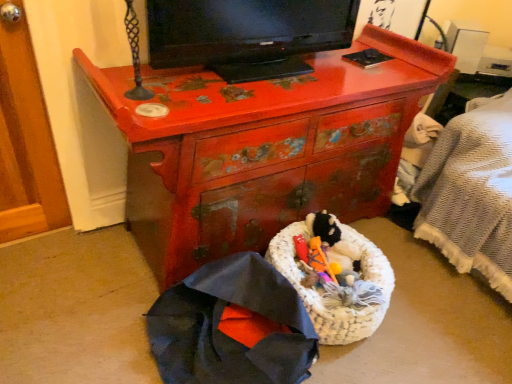
Question: Is cherry wood dresser at center not close to dark blue fabric umbrella at lower left?

Choices:
 (A) yes
 (B) no

Answer: (B)

Question: Considering the relative sizes of cherry wood dresser at center and dark blue fabric umbrella at lower left in the image provided, is cherry wood dresser at center wider than dark blue fabric umbrella at lower left?

Choices:
 (A) no
 (B) yes

Answer: (B)

Question: Can you confirm if cherry wood dresser at center is taller than dark blue fabric umbrella at lower left?

Choices:
 (A) no
 (B) yes

Answer: (B)

Question: Does cherry wood dresser at center have a smaller size compared to dark blue fabric umbrella at lower left?

Choices:
 (A) no
 (B) yes

Answer: (A)

Question: From the image's perspective, is cherry wood dresser at center located above dark blue fabric umbrella at lower left?

Choices:
 (A) no
 (B) yes

Answer: (B)

Question: From the image's perspective, is cherry wood dresser at center under dark blue fabric umbrella at lower left?

Choices:
 (A) yes
 (B) no

Answer: (B)

Question: Considering the relative positions of black glossy television at upper center and cherry wood dresser at center in the image provided, is black glossy television at upper center behind cherry wood dresser at center?

Choices:
 (A) no
 (B) yes

Answer: (B)

Question: Is black glossy television at upper center taller than cherry wood dresser at center?

Choices:
 (A) yes
 (B) no

Answer: (B)

Question: From the image's perspective, is black glossy television at upper center above cherry wood dresser at center?

Choices:
 (A) yes
 (B) no

Answer: (A)

Question: Is black glossy television at upper center closer to camera compared to cherry wood dresser at center?

Choices:
 (A) yes
 (B) no

Answer: (B)

Question: Considering the relative sizes of black glossy television at upper center and cherry wood dresser at center in the image provided, is black glossy television at upper center smaller than cherry wood dresser at center?

Choices:
 (A) no
 (B) yes

Answer: (B)

Question: Considering the relative sizes of black glossy television at upper center and cherry wood dresser at center in the image provided, is black glossy television at upper center thinner than cherry wood dresser at center?

Choices:
 (A) no
 (B) yes

Answer: (B)

Question: Does cherry wood dresser at center have a greater height compared to black glossy television at upper center?

Choices:
 (A) no
 (B) yes

Answer: (B)